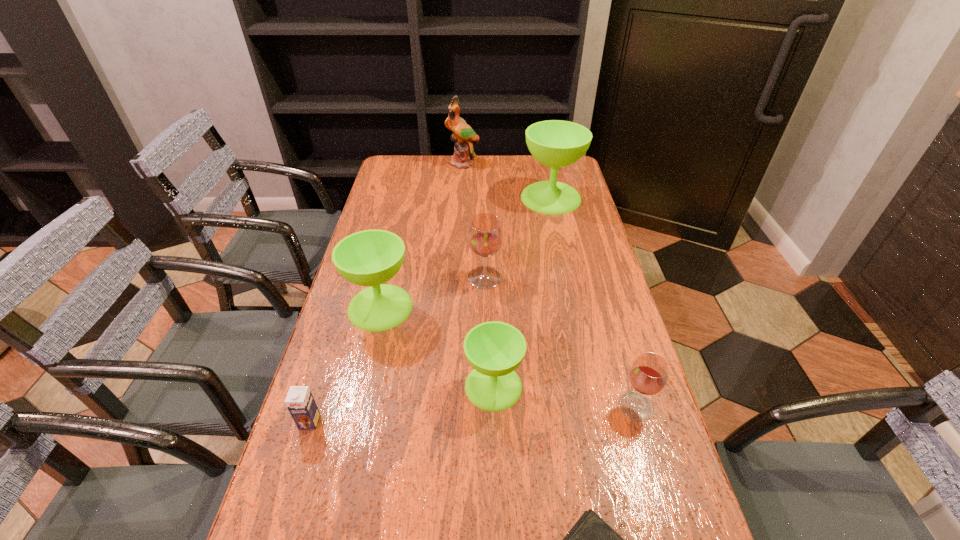
The image size is (960, 540). What are the coordinates of `parrot situated at the far edge` in the screenshot? It's located at (463, 135).

Where is `wineglass that is positioned at the far edge`? Image resolution: width=960 pixels, height=540 pixels. wineglass that is positioned at the far edge is located at coordinates (555, 143).

Locate an element on the screen. wineglass that is at the left edge is located at coordinates (371, 257).

I want to click on chocolate milk that is at the left edge, so click(300, 402).

Find the location of `object that is positioned at the far right corner`. object that is positioned at the far right corner is located at coordinates (555, 143).

What are the coordinates of `vacant space at the far edge of the desktop` in the screenshot? It's located at (488, 178).

The image size is (960, 540). In order to click on vacant area at the left edge of the desktop in this screenshot , I will do `click(391, 196)`.

In the image, there is a desktop. Where is `vacant space at the right edge`? Image resolution: width=960 pixels, height=540 pixels. vacant space at the right edge is located at coordinates (563, 269).

Identify which object is the third closest to the nearest green wineglass. Please provide its 2D coordinates. Your answer should be formatted as a tuple, i.e. [(x, y)], where the tuple contains the x and y coordinates of a point satisfying the conditions above.

[(591, 539)]

Where is `the fifth closest object to the tallest wineglass`? the fifth closest object to the tallest wineglass is located at coordinates (648, 375).